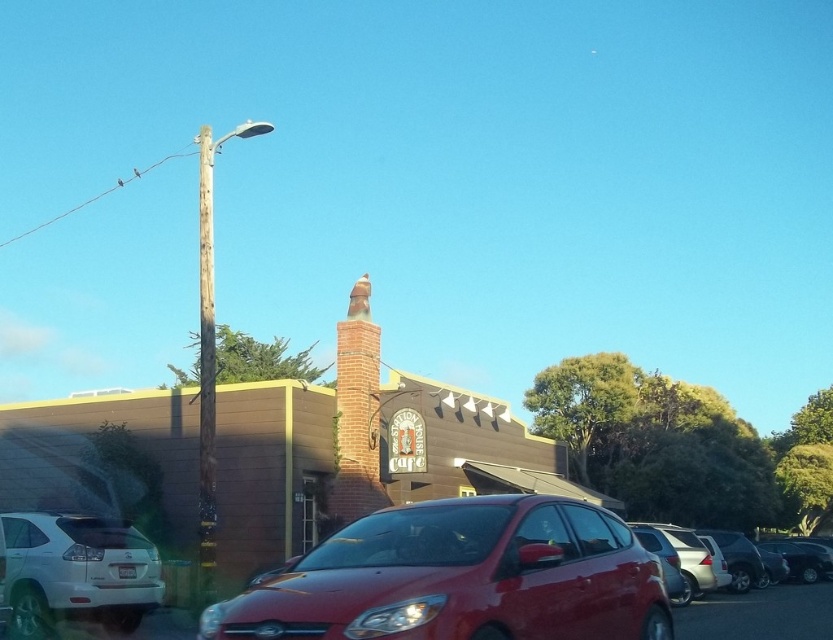
Question: Can you confirm if white matte suv at lower left is positioned to the left of weathered wood pole at left?

Choices:
 (A) no
 (B) yes

Answer: (A)

Question: Can you confirm if white matte suv at lower left is positioned to the right of weathered wood pole at upper left?

Choices:
 (A) yes
 (B) no

Answer: (A)

Question: Which is farther from the metallic silver car at lower right?

Choices:
 (A) white matte suv at lower left
 (B) weathered wood pole at upper left
 (C) glossy red sedan at center

Answer: (B)

Question: Which is nearer to the metallic silver car at lower right?

Choices:
 (A) glossy red sedan at center
 (B) weathered wood pole at left

Answer: (A)

Question: Which object is the farthest from the metallic silver car at lower right?

Choices:
 (A) glossy red sedan at center
 (B) weathered wood pole at upper left
 (C) white matte suv at lower left
 (D) weathered wood pole at left

Answer: (B)

Question: Does metallic silver car at lower right appear under weathered wood pole at left?

Choices:
 (A) no
 (B) yes

Answer: (B)